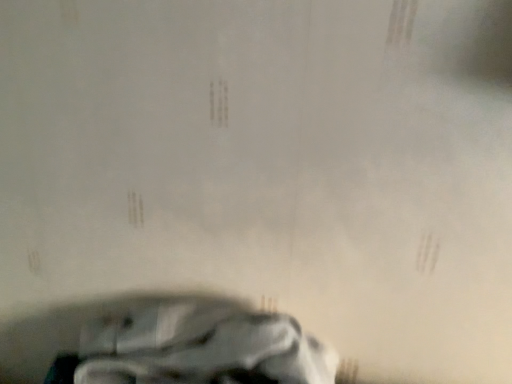
Find the location of `matte gray fabric at lower center`. matte gray fabric at lower center is located at coordinates (201, 348).

The width and height of the screenshot is (512, 384). What do you see at coordinates (201, 348) in the screenshot?
I see `matte gray fabric at lower center` at bounding box center [201, 348].

Find the location of a particular element. The width and height of the screenshot is (512, 384). matte gray fabric at lower center is located at coordinates (201, 348).